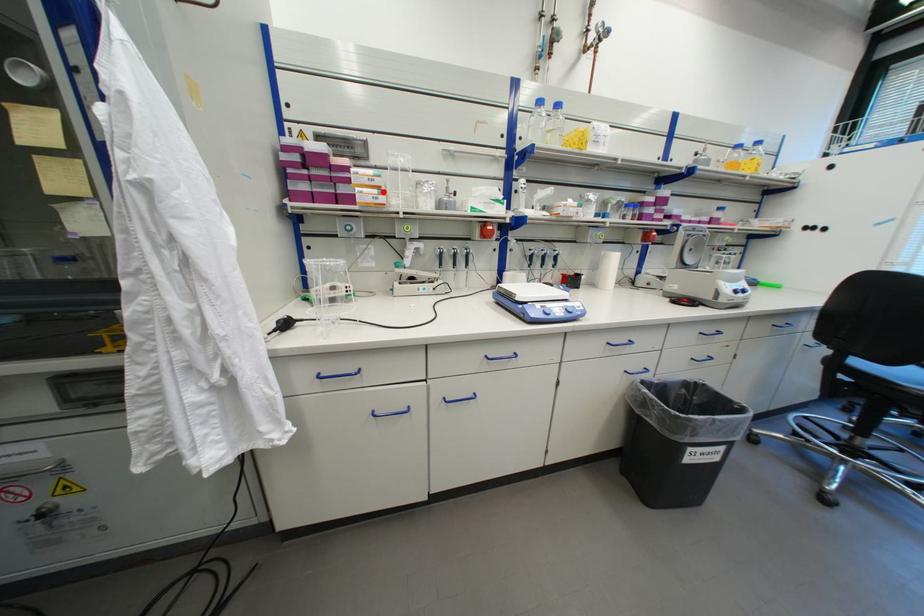
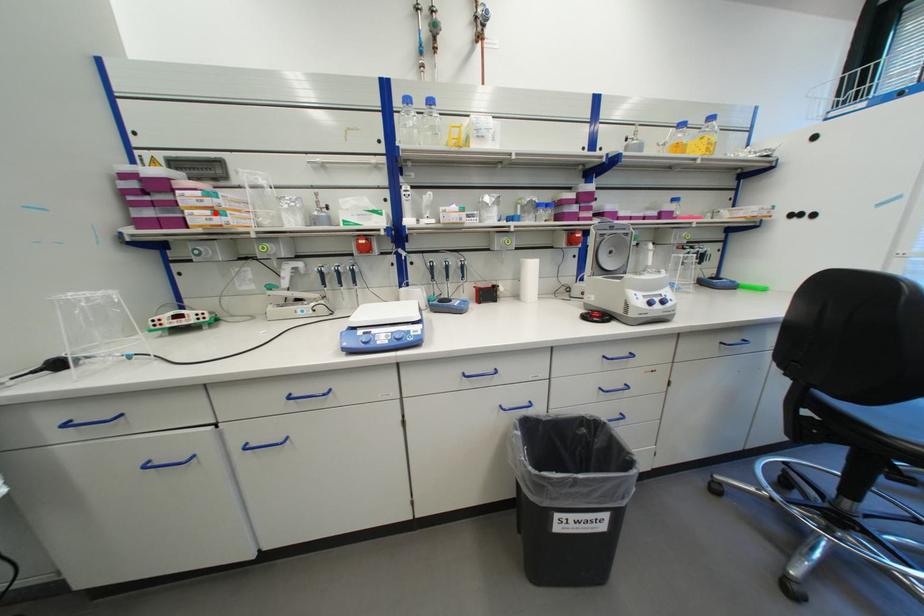
I am providing you with two images of the same scene from different viewpoints. A red point is marked on the first image and another point is marked on the second image. Is the red point in image1 aligned with the point shown in image2?

Yes